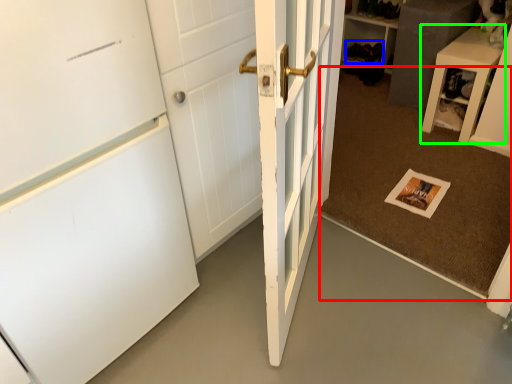
Question: Based on their relative distances, which object is farther from doormat (highlighted by a red box)? Choose from shoe (highlighted by a blue box) and furniture (highlighted by a green box).

Choices:
 (A) shoe
 (B) furniture

Answer: (A)